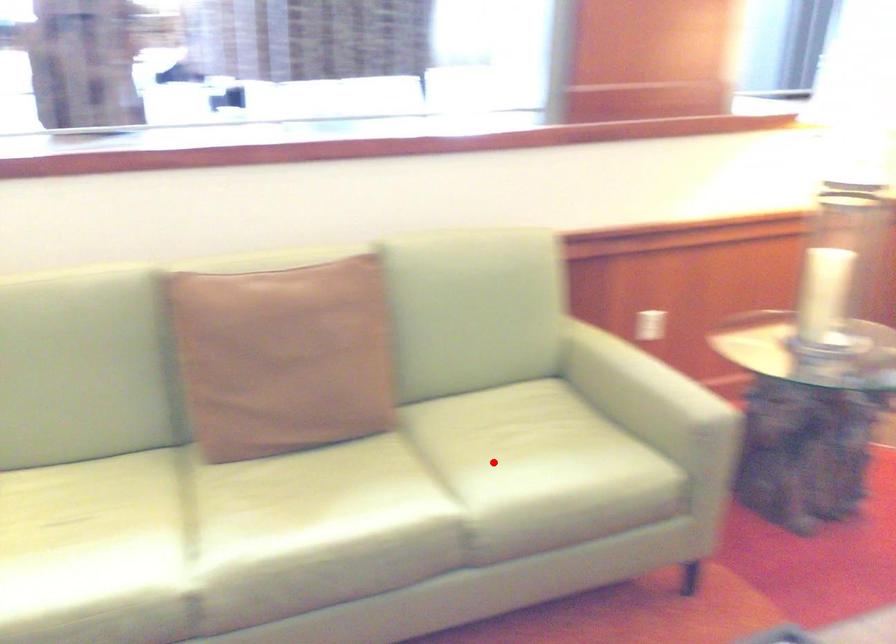
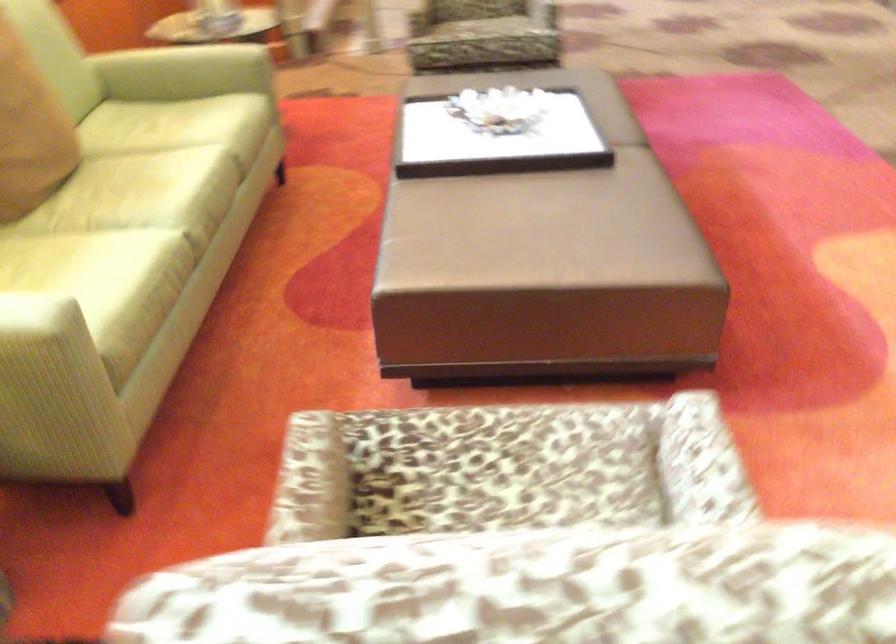
Question: A red point is marked in image1. In image2, is the corresponding 3D point closer to the camera or farther? Reply with the corresponding letter.

Choices:
 (A) The corresponding 3D point is closer.
 (B) The corresponding 3D point is farther.

Answer: (B)